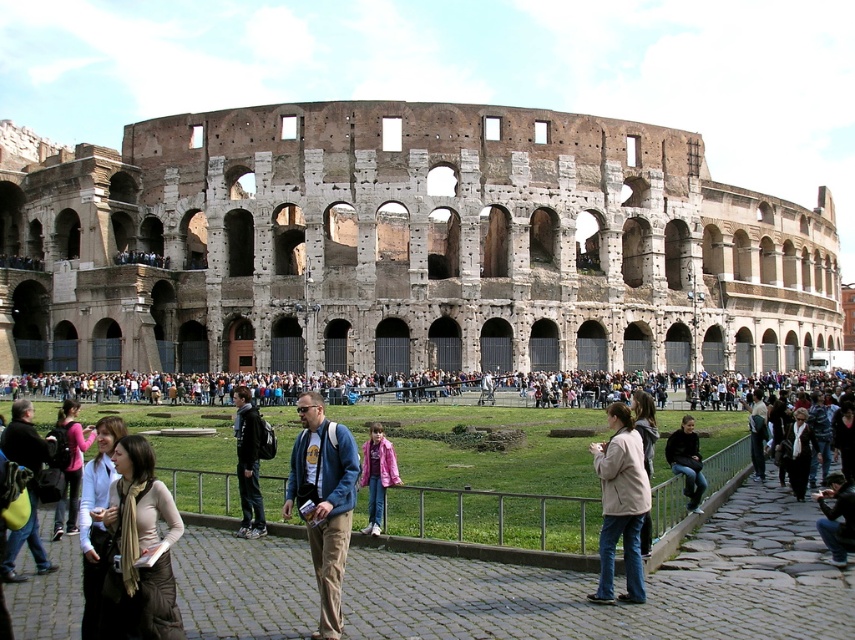
Can you confirm if blue denim jacket at center is shorter than matte pink backpack at lower left?

No, blue denim jacket at center is not shorter than matte pink backpack at lower left.

Who is taller, blue denim jacket at center or matte pink backpack at lower left?

blue denim jacket at center is taller.

Describe the element at coordinates (323, 500) in the screenshot. This screenshot has height=640, width=855. I see `blue denim jacket at center` at that location.

Locate an element on the screen. The width and height of the screenshot is (855, 640). blue denim jacket at center is located at coordinates (323, 500).

Which is above, multicolored fabric crowd at center or dark blue denim jeans at lower right?

multicolored fabric crowd at center

The width and height of the screenshot is (855, 640). Describe the element at coordinates (419, 387) in the screenshot. I see `multicolored fabric crowd at center` at that location.

Locate an element on the screen. The width and height of the screenshot is (855, 640). multicolored fabric crowd at center is located at coordinates (419, 387).

Is matte pink backpack at lower left wider than white scarf at center?

Yes.

Can you confirm if matte pink backpack at lower left is smaller than white scarf at center?

Actually, matte pink backpack at lower left might be larger than white scarf at center.

Find the location of a particular element. matte pink backpack at lower left is located at coordinates (71, 467).